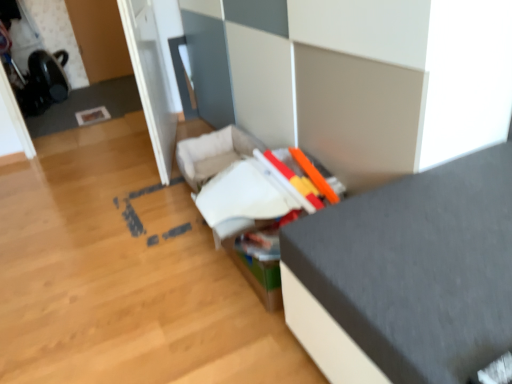
Identify the location of free spot in front of matte plastic storage box at center. (223, 339).